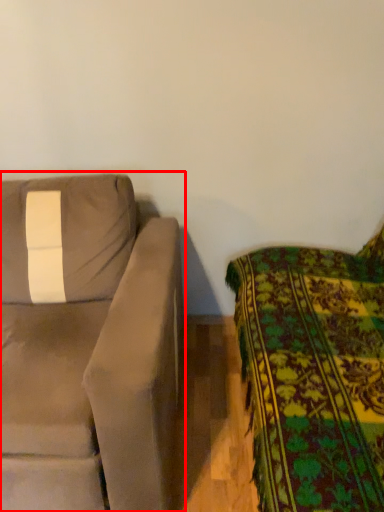
Question: From the image's perspective, where is studio couch (annotated by the red box) located in relation to studio couch in the image?

Choices:
 (A) below
 (B) above

Answer: (B)